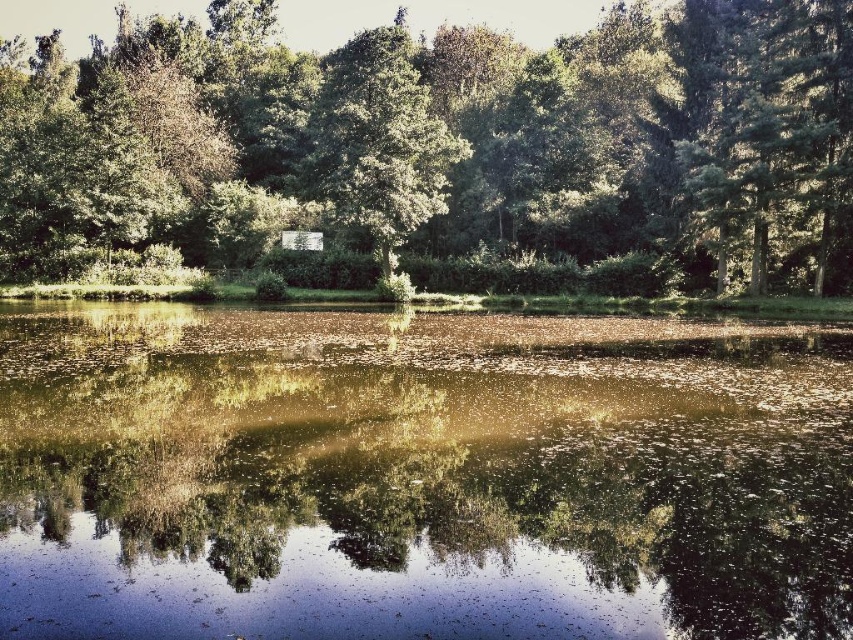
Find the location of a particular element. green leafy tree at upper center is located at coordinates (444, 141).

Can you confirm if green leafy tree at upper center is thinner than green textured tree at upper right?

In fact, green leafy tree at upper center might be wider than green textured tree at upper right.

What do you see at coordinates (444, 141) in the screenshot? I see `green leafy tree at upper center` at bounding box center [444, 141].

The image size is (853, 640). In order to click on green leafy tree at upper center in this screenshot , I will do `click(444, 141)`.

Between point (830, 205) and point (326, 108), which one is positioned in front?

Positioned in front is point (830, 205).

Between point (849, 276) and point (445, 211), which one is positioned behind?

Positioned behind is point (849, 276).

Find the location of a particular element. This screenshot has width=853, height=640. green textured tree at upper right is located at coordinates tap(769, 128).

This screenshot has width=853, height=640. I want to click on green textured tree at upper right, so click(769, 128).

Is translucent reflective water at center bigger than green leafy tree at upper center?

Incorrect, translucent reflective water at center is not larger than green leafy tree at upper center.

Consider the image. Does translucent reflective water at center have a lesser height compared to green leafy tree at upper center?

Yes, translucent reflective water at center is shorter than green leafy tree at upper center.

What do you see at coordinates (421, 476) in the screenshot? The height and width of the screenshot is (640, 853). I see `translucent reflective water at center` at bounding box center [421, 476].

The height and width of the screenshot is (640, 853). Identify the location of translucent reflective water at center. (421, 476).